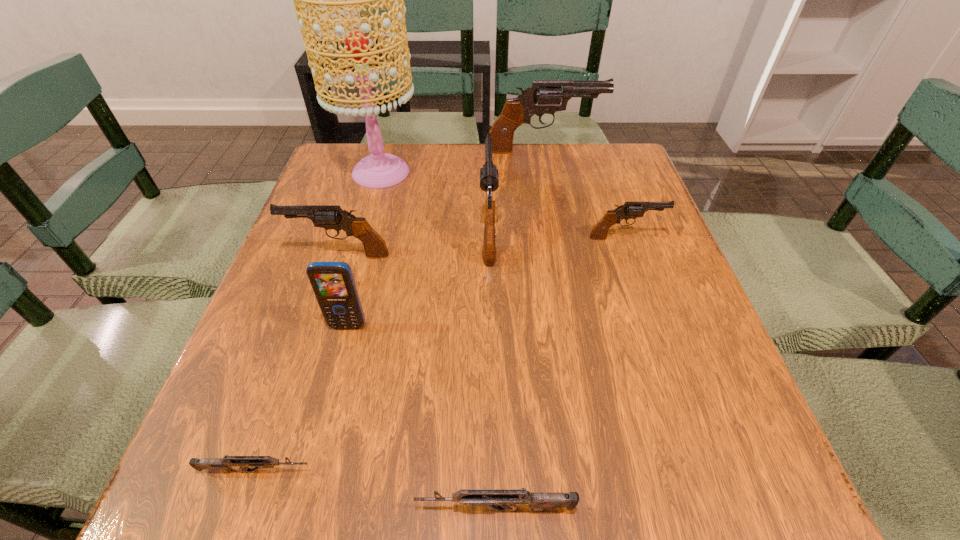
Image resolution: width=960 pixels, height=540 pixels. Identify the location of the nearest gun. (505, 500).

In order to click on the smaller grey gun in this screenshot , I will do `click(225, 464)`.

Where is `the second nearest object`? The width and height of the screenshot is (960, 540). the second nearest object is located at coordinates [x=225, y=464].

Find the location of `vacant area situated 0.360m on the right of the tallest object`. vacant area situated 0.360m on the right of the tallest object is located at coordinates (556, 172).

Identify the location of vacant space situated along the barrel of the third smallest black gun. This screenshot has width=960, height=540. (487, 147).

Identify the location of free region located along the barrel of the third smallest black gun. The height and width of the screenshot is (540, 960). (487, 165).

Image resolution: width=960 pixels, height=540 pixels. In order to click on free spot located 0.180m along the barrel of the third smallest black gun in this screenshot , I will do `click(487, 155)`.

This screenshot has height=540, width=960. I want to click on vacant space positioned 0.220m on the screen of the third nearest object, so click(316, 449).

Find the location of `free space located aimed along the barrel of the nearest object`. free space located aimed along the barrel of the nearest object is located at coordinates (256, 509).

Identify the location of vacant space situated aimed along the barrel of the nearest object. This screenshot has height=540, width=960. (256, 509).